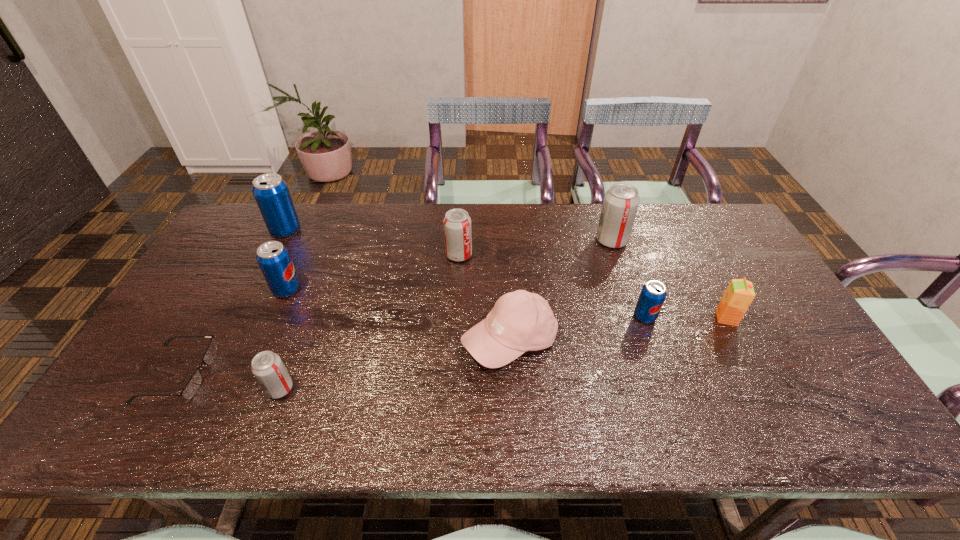
Locate an element on the screen. the biggest blue pop soda is located at coordinates (271, 192).

At what (x,y) coordinates should I click in order to perform the action: click on the biggest gray soda can. Please return your answer as a coordinate pair (x, y). Looking at the image, I should click on (620, 205).

This screenshot has height=540, width=960. What are the coordinates of `the second biggest gray soda can` in the screenshot? It's located at (457, 223).

At what (x,y) coordinates should I click in order to perform the action: click on the second gray soda can from left to right. Please return your answer as a coordinate pair (x, y). Looking at the image, I should click on (457, 223).

The width and height of the screenshot is (960, 540). I want to click on the sixth nearest object, so click(x=273, y=258).

Where is `the second biggest blue pop soda`? The height and width of the screenshot is (540, 960). the second biggest blue pop soda is located at coordinates (273, 258).

You are a GUI agent. You are given a task and a screenshot of the screen. Output one action in this format:
    pyautogui.click(x=<x>, y=<y>)
    Task: Click on the rightmost object
    
    Given the screenshot: What is the action you would take?
    pyautogui.click(x=740, y=293)

At what (x,y) coordinates should I click in order to perform the action: click on pink baseball cap. Please return your answer as a coordinate pair (x, y). Image resolution: width=960 pixels, height=540 pixels. Looking at the image, I should click on (520, 321).

The image size is (960, 540). Find the location of `the rightmost blue pop soda`. the rightmost blue pop soda is located at coordinates (653, 293).

At what (x,y) coordinates should I click in order to perform the action: click on the nearest blue pop soda. Please return your answer as a coordinate pair (x, y). The image size is (960, 540). Looking at the image, I should click on (653, 293).